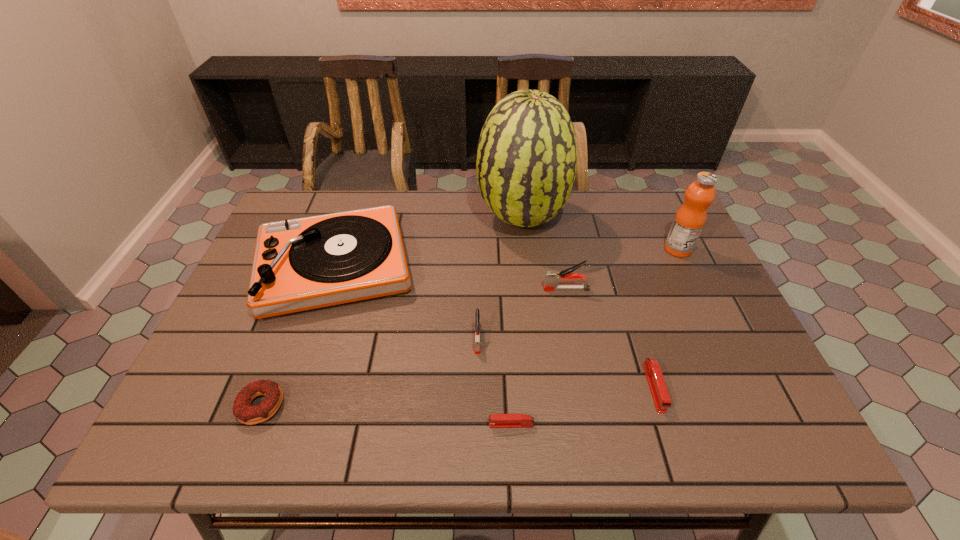
Find the location of a particular element. the farther red stapler is located at coordinates (654, 376).

Image resolution: width=960 pixels, height=540 pixels. What are the coordinates of `chocolate doughnut` in the screenshot? It's located at (245, 413).

Locate an element on the screen. This screenshot has width=960, height=540. the shortest object is located at coordinates (495, 420).

Find the location of a particular element. The width and height of the screenshot is (960, 540). the smaller red stapler is located at coordinates (495, 420).

Where is `free space located 0.210m on the front of the tallest object`? The height and width of the screenshot is (540, 960). free space located 0.210m on the front of the tallest object is located at coordinates (531, 302).

Where is `free space located on the left of the rightmost object`? Image resolution: width=960 pixels, height=540 pixels. free space located on the left of the rightmost object is located at coordinates (x=606, y=249).

Where is `vacant space situated on the front of the record player`? The height and width of the screenshot is (540, 960). vacant space situated on the front of the record player is located at coordinates (292, 393).

At what (x,y) coordinates should I click in order to perform the action: click on vacant space located 0.090m on the handle side of the right gray stapler. Please return your answer as a coordinate pair (x, y). The image size is (960, 540). Looking at the image, I should click on (510, 289).

The width and height of the screenshot is (960, 540). What are the coordinates of `free region located on the handle side of the right gray stapler` in the screenshot? It's located at (464, 289).

The height and width of the screenshot is (540, 960). I want to click on vacant space located on the handle side of the right gray stapler, so click(x=392, y=289).